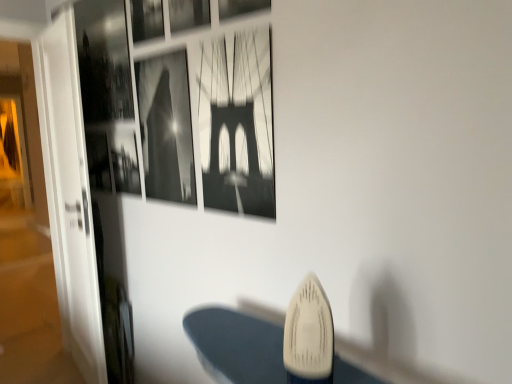
Question: Considering the relative sizes of black paper at center, marked as the fourth picture frame in a left-to-right arrangement, and metallic silver picture frame at upper center, the 3th picture frame when ordered from right to left, in the image provided, is black paper at center, marked as the fourth picture frame in a left-to-right arrangement, shorter than metallic silver picture frame at upper center, the 3th picture frame when ordered from right to left,?

Choices:
 (A) yes
 (B) no

Answer: (B)

Question: Can you confirm if black paper at center, the second picture frame in the right-to-left sequence, is smaller than metallic silver picture frame at upper center, which ranks as the third picture frame in left-to-right order?

Choices:
 (A) yes
 (B) no

Answer: (B)

Question: Is black paper at center, the second picture frame in the right-to-left sequence, aimed at metallic silver picture frame at upper center, the 3th picture frame when ordered from right to left?

Choices:
 (A) yes
 (B) no

Answer: (B)

Question: From a real-world perspective, is black paper at center, the second picture frame in the right-to-left sequence, physically below metallic silver picture frame at upper center, the 3th picture frame when ordered from right to left?

Choices:
 (A) yes
 (B) no

Answer: (A)

Question: Considering the relative positions of black paper at center, the second picture frame in the right-to-left sequence, and metallic silver picture frame at upper center, which ranks as the third picture frame in left-to-right order, in the image provided, is black paper at center, the second picture frame in the right-to-left sequence, behind metallic silver picture frame at upper center, which ranks as the third picture frame in left-to-right order,?

Choices:
 (A) no
 (B) yes

Answer: (A)

Question: Relative to metallic silver picture frame at upper center, the first picture frame positioned from the left, is black and white photograph at upper center, placed as the 4th picture frame when sorted from right to left, in front or behind?

Choices:
 (A) behind
 (B) front

Answer: (B)

Question: Looking at the image, does black and white photograph at upper center, the second picture frame in the left-to-right sequence, seem bigger or smaller compared to metallic silver picture frame at upper center, which appears as the 5th picture frame when viewed from the right?

Choices:
 (A) big
 (B) small

Answer: (A)

Question: Looking at their shapes, would you say black and white photograph at upper center, the second picture frame in the left-to-right sequence, is wider or thinner than metallic silver picture frame at upper center, the first picture frame positioned from the left?

Choices:
 (A) thin
 (B) wide

Answer: (B)

Question: Based on their positions, is black and white photograph at upper center, the second picture frame in the left-to-right sequence, located to the left or right of metallic silver picture frame at upper center, the first picture frame positioned from the left?

Choices:
 (A) right
 (B) left

Answer: (A)

Question: Does point (176, 31) appear closer or farther from the camera than point (293, 362)?

Choices:
 (A) closer
 (B) farther

Answer: (B)

Question: In terms of height, does metallic silver picture frame at upper center, the 3th picture frame when ordered from right to left, look taller or shorter compared to white plastic iron at lower center?

Choices:
 (A) short
 (B) tall

Answer: (B)

Question: Considering the positions of metallic silver picture frame at upper center, the 3th picture frame when ordered from right to left, and white plastic iron at lower center in the image, is metallic silver picture frame at upper center, the 3th picture frame when ordered from right to left, bigger or smaller than white plastic iron at lower center?

Choices:
 (A) big
 (B) small

Answer: (B)

Question: From the image's perspective, is metallic silver picture frame at upper center, the 3th picture frame when ordered from right to left, located above or below white plastic iron at lower center?

Choices:
 (A) above
 (B) below

Answer: (A)

Question: Considering the positions of black paper at center, marked as the fourth picture frame in a left-to-right arrangement, and metallic silver picture frame at upper center, the 3th picture frame when ordered from right to left, in the image, is black paper at center, marked as the fourth picture frame in a left-to-right arrangement, wider or thinner than metallic silver picture frame at upper center, the 3th picture frame when ordered from right to left,?

Choices:
 (A) wide
 (B) thin

Answer: (A)

Question: Considering the positions of black paper at center, the second picture frame in the right-to-left sequence, and metallic silver picture frame at upper center, which ranks as the third picture frame in left-to-right order, in the image, is black paper at center, the second picture frame in the right-to-left sequence, bigger or smaller than metallic silver picture frame at upper center, which ranks as the third picture frame in left-to-right order,?

Choices:
 (A) big
 (B) small

Answer: (A)